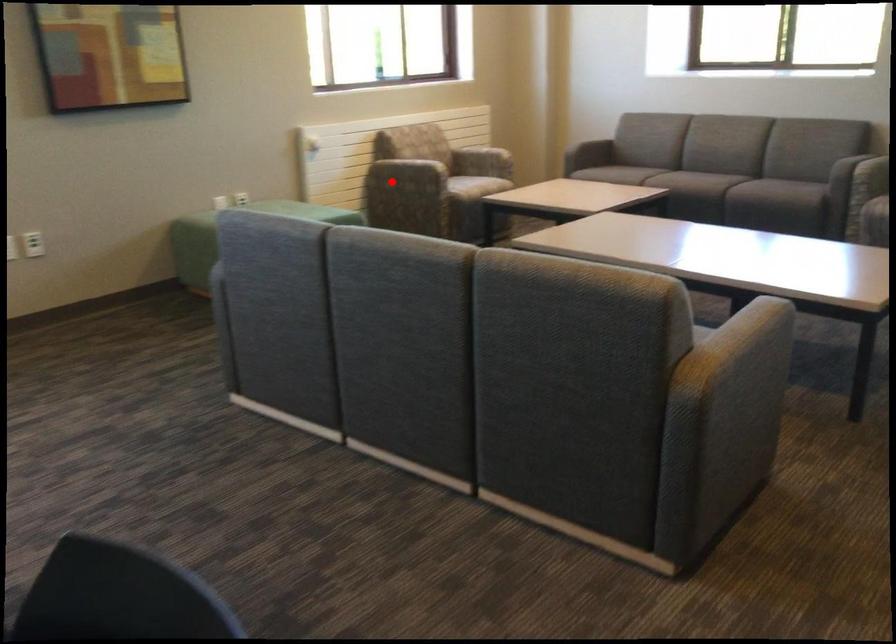
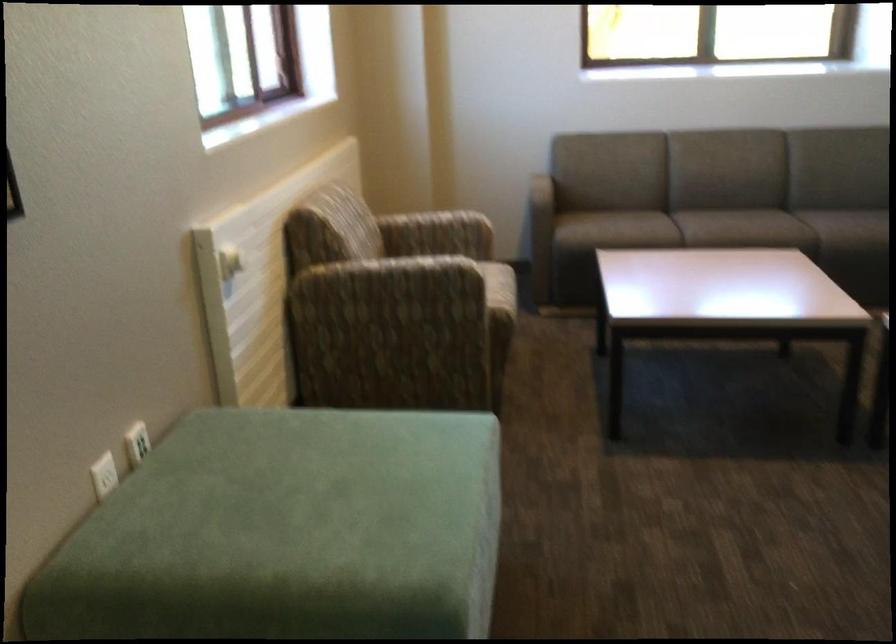
Locate, in the second image, the point that corresponds to the highlighted location in the first image.

(386, 312)